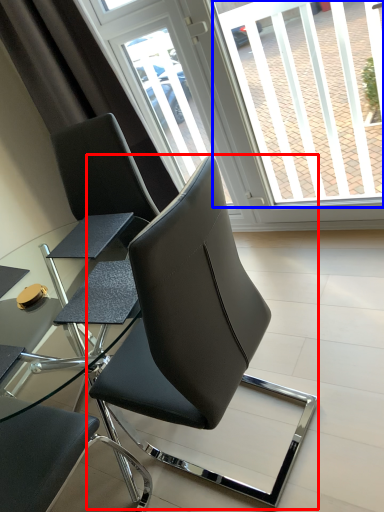
Question: Which object is closer to the camera taking this photo, chair (highlighted by a red box) or window screen (highlighted by a blue box)?

Choices:
 (A) chair
 (B) window screen

Answer: (A)